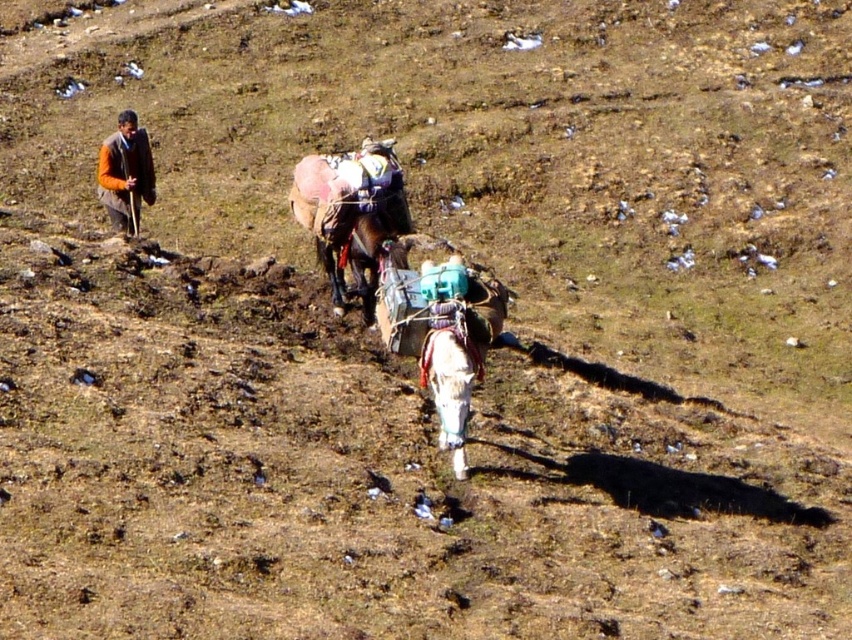
Question: Among these objects, which one is nearest to the camera?

Choices:
 (A) brown woolen sweater at upper left
 (B) brown leather mule at center

Answer: (B)

Question: Estimate the real-world distances between objects in this image. Which object is closer to the brown woolen sweater at upper left?

Choices:
 (A) white woolen blanket at center
 (B) brown leather mule at center

Answer: (B)

Question: Considering the relative positions of brown leather mule at center and white woolen blanket at center in the image provided, where is brown leather mule at center located with respect to white woolen blanket at center?

Choices:
 (A) left
 (B) right

Answer: (A)

Question: Does white woolen blanket at center have a lesser width compared to brown woolen sweater at upper left?

Choices:
 (A) no
 (B) yes

Answer: (B)

Question: Is brown leather mule at center wider than white woolen blanket at center?

Choices:
 (A) no
 (B) yes

Answer: (B)

Question: Based on their relative distances, which object is farther from the brown leather mule at center?

Choices:
 (A) brown woolen sweater at upper left
 (B) white woolen blanket at center

Answer: (A)